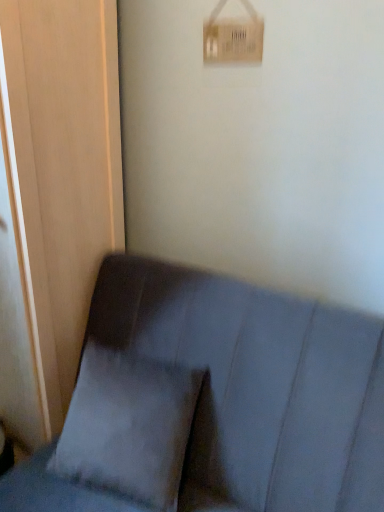
Question: Does matte wood screen door at left have a greater height compared to suede gray couch at lower left?

Choices:
 (A) no
 (B) yes

Answer: (B)

Question: From the image's perspective, is matte wood screen door at left over suede gray couch at lower left?

Choices:
 (A) yes
 (B) no

Answer: (A)

Question: Is the depth of matte wood screen door at left less than that of suede gray couch at lower left?

Choices:
 (A) no
 (B) yes

Answer: (A)

Question: From a real-world perspective, is matte wood screen door at left over suede gray couch at lower left?

Choices:
 (A) yes
 (B) no

Answer: (A)

Question: Is matte wood screen door at left positioned with its back to suede gray couch at lower left?

Choices:
 (A) no
 (B) yes

Answer: (A)

Question: From a real-world perspective, relative to white cardboard light switch at upper center, is suede gray couch at lower left vertically above or below?

Choices:
 (A) above
 (B) below

Answer: (B)

Question: Considering the positions of point (249, 433) and point (258, 60), is point (249, 433) closer or farther from the camera than point (258, 60)?

Choices:
 (A) closer
 (B) farther

Answer: (A)

Question: Is suede gray couch at lower left in front of or behind white cardboard light switch at upper center in the image?

Choices:
 (A) front
 (B) behind

Answer: (A)

Question: Looking at their shapes, would you say suede gray couch at lower left is wider or thinner than white cardboard light switch at upper center?

Choices:
 (A) thin
 (B) wide

Answer: (B)

Question: Considering the positions of matte wood screen door at left and gray fabric pillow at lower left in the image, is matte wood screen door at left wider or thinner than gray fabric pillow at lower left?

Choices:
 (A) thin
 (B) wide

Answer: (B)

Question: In terms of size, does matte wood screen door at left appear bigger or smaller than gray fabric pillow at lower left?

Choices:
 (A) big
 (B) small

Answer: (A)

Question: Which is correct: matte wood screen door at left is inside gray fabric pillow at lower left, or outside of it?

Choices:
 (A) inside
 (B) outside

Answer: (B)

Question: In the image, is matte wood screen door at left positioned in front of or behind gray fabric pillow at lower left?

Choices:
 (A) front
 (B) behind

Answer: (A)

Question: Considering the relative positions of suede gray couch at lower left and matte wood screen door at left in the image provided, is suede gray couch at lower left to the left or to the right of matte wood screen door at left?

Choices:
 (A) right
 (B) left

Answer: (A)

Question: From a real-world perspective, is suede gray couch at lower left positioned above or below matte wood screen door at left?

Choices:
 (A) below
 (B) above

Answer: (A)